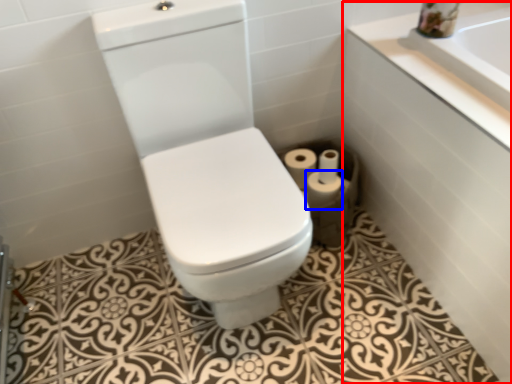
Question: Which object appears farthest to the camera in this image, bath (highlighted by a red box) or toilet paper (highlighted by a blue box)?

Choices:
 (A) bath
 (B) toilet paper

Answer: (B)